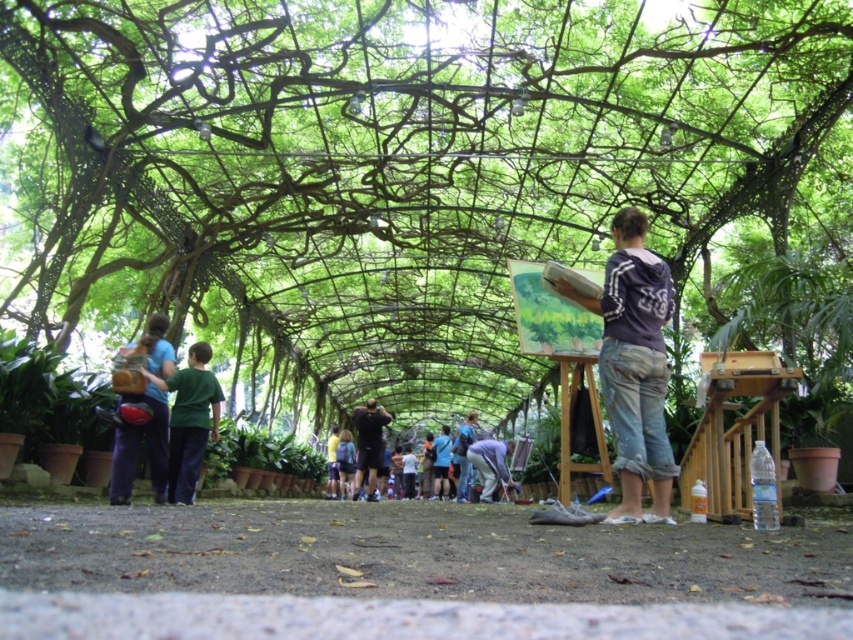
Who is taller, green leafy tree at center or dark blue jeans at center?

Standing taller between the two is green leafy tree at center.

Can you confirm if green leafy tree at center is positioned to the right of dark blue jeans at center?

Incorrect, green leafy tree at center is not on the right side of dark blue jeans at center.

The width and height of the screenshot is (853, 640). In order to click on green leafy tree at center in this screenshot , I will do `click(392, 164)`.

Locate an element on the screen. This screenshot has height=640, width=853. white hoodie at center is located at coordinates (634, 365).

Between white hoodie at center and green cotton shirt at center, which one has more height?

Standing taller between the two is white hoodie at center.

Between point (616, 280) and point (190, 385), which one is positioned behind?

Point (190, 385)

Find the location of a particular element. The image size is (853, 640). white hoodie at center is located at coordinates click(634, 365).

Is white hoodie at center to the right of matte purple pants at left from the viewer's perspective?

Indeed, white hoodie at center is positioned on the right side of matte purple pants at left.

Who is more forward, (618, 465) or (164, 342)?

Point (618, 465) is in front.

Find the location of `white hoodie at center`. white hoodie at center is located at coordinates (634, 365).